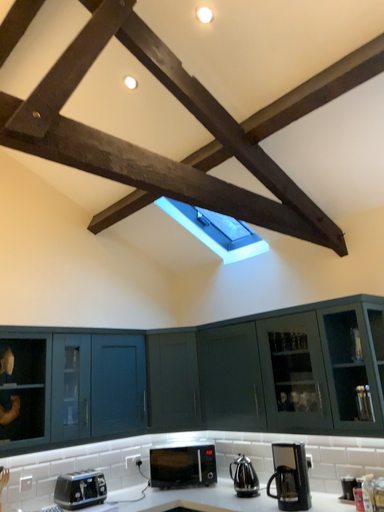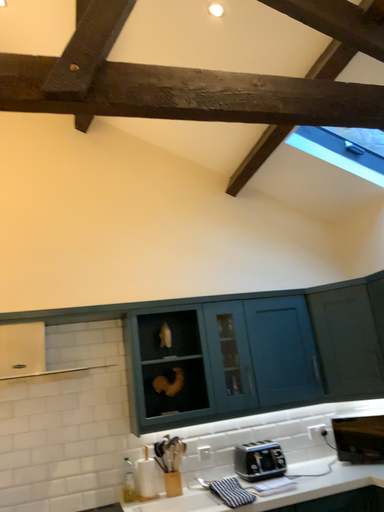
Question: Which way did the camera rotate in the video?

Choices:
 (A) rotated downward
 (B) rotated upward

Answer: (A)